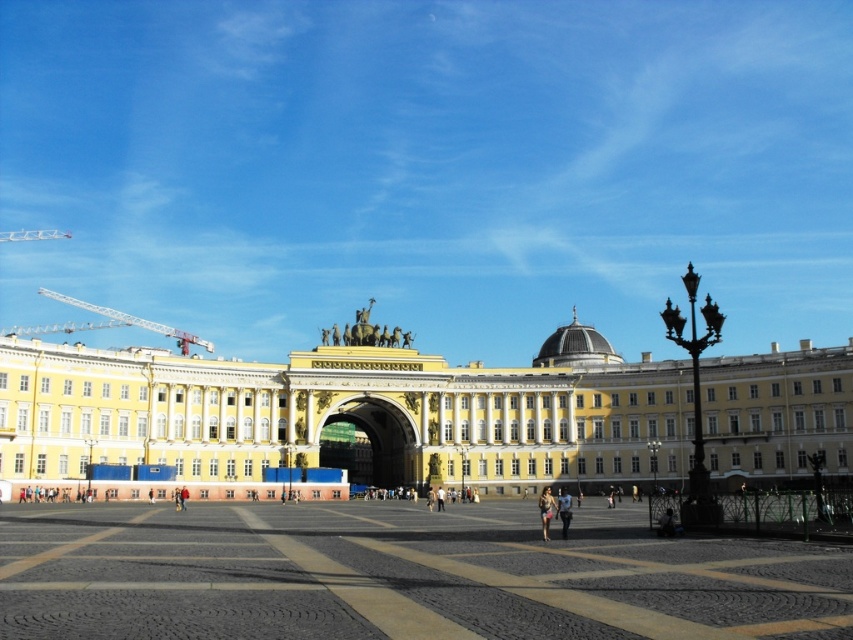
From the picture: You are a construction worker who needs to move a heavy beam from the metallic construction crane at left to the building. The beam is 130 meters long. Can you safely transport it without it touching the ground?

The distance between the metallic construction crane at left and the building is 128.43 meters. Since the beam is 130 meters long, it would extend beyond the gap, so it cannot be safely transported without touching the ground.

You are standing at the point marked by coordinates point (425,412) in the plaza in front of the yellow white stone building at center. If you turn to face the building, which direction should you face?

The point (425,412) is part of the yellow white stone building at center, so you are already facing the building. Therefore, you don not need to turn. Face the building directly in front of you.

You are standing at the point labeled point (405, 360) and want to walk towards the entrance of the grand historic building. Is the point labeled point (24, 236) located behind you or in front of you as you face the building?

The point labeled point (24, 236) is behind you as you face the building because point (405, 360) is in front of point (24, 236) according to the description.